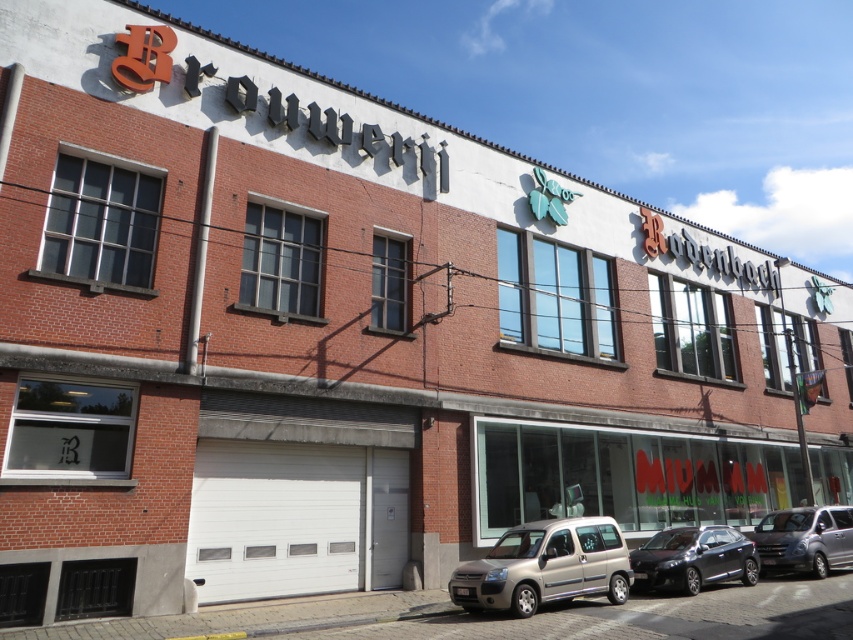
You are a delivery person who needs to park your vehicle in the parking lot behind the Brouwerij Rodenbach building. The parking spot you want to use has a height restriction of 1.8 meters. You have a silver metallic van at center and a satin black car at lower center. Which vehicle should you choose to park there without exceeding the height limit?

The satin black car at lower center is shorter than the silver metallic van at center. Since the parking spot has a 1.8 meters height restriction, you should choose the satin black car at lower center to park there without exceeding the height limit.

You are a delivery driver who needs to park your silver metallic van at center in the parking lot near the Brouwerij Rodenbach building. There is a metallic silver van at lower right already parked there. Considering their sizes, which van takes up more space in the parking spot?

The metallic silver van at lower right takes up more space in the parking spot because it has a greater width than the silver metallic van at center.